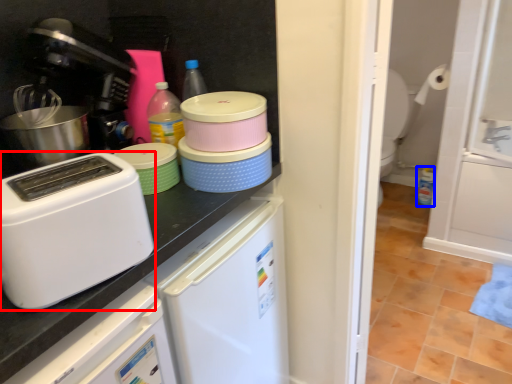
Question: Among these objects, which one is farthest to the camera, home appliance (highlighted by a red box) or bottle (highlighted by a blue box)?

Choices:
 (A) home appliance
 (B) bottle

Answer: (B)